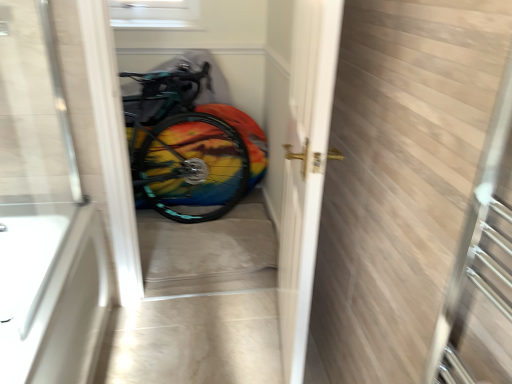
Question: From their relative heights in the image, would you say multicolored fabric at center is taller or shorter than transparent glass door at left?

Choices:
 (A) short
 (B) tall

Answer: (A)

Question: Relative to transparent glass door at left, is multicolored fabric at center in front or behind?

Choices:
 (A) front
 (B) behind

Answer: (B)

Question: Which is nearer to the rainbow painted bicycle at center?

Choices:
 (A) transparent glass door at left
 (B) multicolored fabric at center
 (C) white glossy door handle at center
 (D) white glossy bathtub at lower left

Answer: (B)

Question: Which object is positioned closest to the rainbow painted bicycle at center?

Choices:
 (A) white glossy door handle at center
 (B) multicolored fabric at center
 (C) white glossy bathtub at lower left
 (D) transparent glass door at left

Answer: (B)